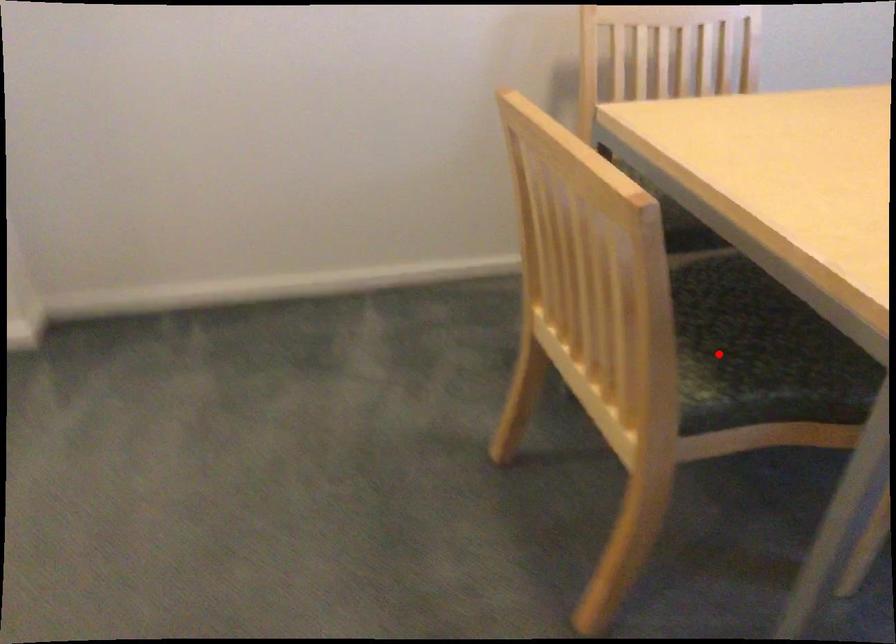
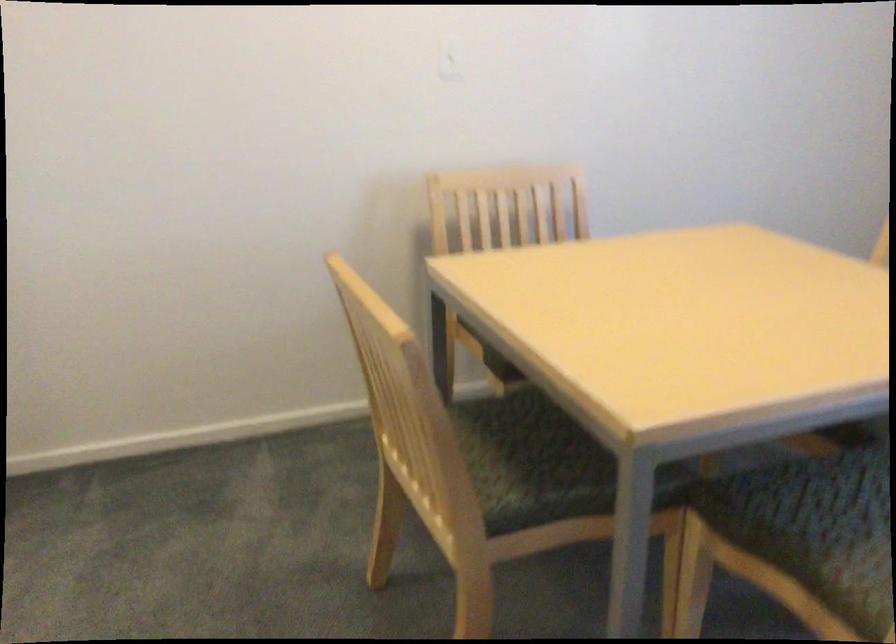
Find the pixel in the second image that matches the highlighted location in the first image.

(530, 462)